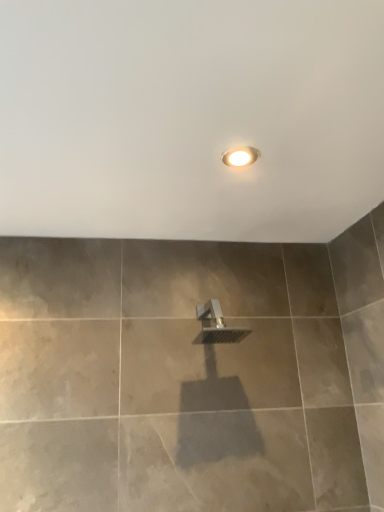
Identify the location of matte white light fixture at upper center. This screenshot has height=512, width=384. pyautogui.click(x=240, y=156).

Describe the element at coordinates (240, 156) in the screenshot. I see `matte white light fixture at upper center` at that location.

The height and width of the screenshot is (512, 384). What are the coordinates of `matte white light fixture at upper center` in the screenshot? It's located at (240, 156).